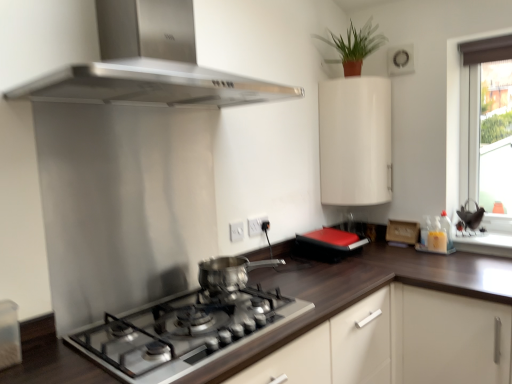
Question: From the image's perspective, is green matte plant at upper right above or below dark wood countertop at center?

Choices:
 (A) below
 (B) above

Answer: (B)

Question: In terms of width, does green matte plant at upper right look wider or thinner when compared to dark wood countertop at center?

Choices:
 (A) thin
 (B) wide

Answer: (A)

Question: Which object is positioned farthest from the green matte plant at upper right?

Choices:
 (A) dark wood countertop at center
 (B) matte brown curtain at upper right
 (C) stainless steel range hood at upper center
 (D) white glossy cabinet at upper right
 (E) satin silver gas stove at center

Answer: (E)

Question: Which object is positioned closest to the green matte plant at upper right?

Choices:
 (A) dark wood countertop at center
 (B) polished silver pot at center
 (C) white glossy cabinet at upper right
 (D) satin silver gas stove at center
 (E) matte brown curtain at upper right

Answer: (C)